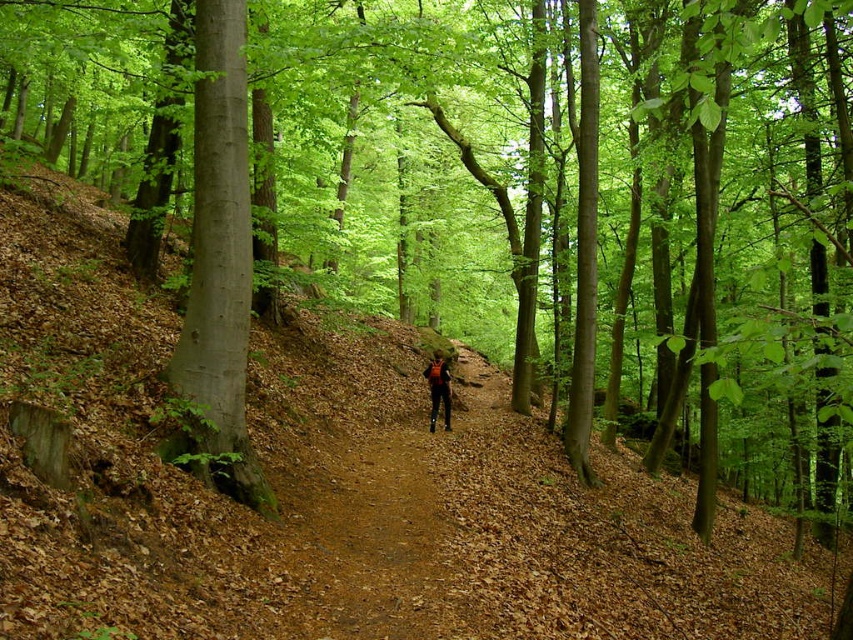
You are standing at the edge of the forest and see the point marked at coordinate (368,538). Based on the scene description, what object does this coordinate most likely represent?

The point at coordinate (368,538) corresponds to the brown gravel path at center, as stated in the objects description.

You are standing at the edge of the forest and see a point marked at coordinates (x=368, y=538). According to the scene description, what does this point most likely represent?

The point at coordinates (x=368, y=538) corresponds to the brown gravel path at center, as stated in the Objects Description.

You are hiking in the forest and want to walk along the brown gravel path at center while carrying your camouflage fabric backpack at center. Considering the path width, will you have enough space to walk comfortably without the backpack touching the ground or the sides?

The brown gravel path at center has a lesser width compared to the camouflage fabric backpack at center. This means the path is narrower than the backpack, so you might not have enough space to walk comfortably without the backpack touching the sides or the ground.